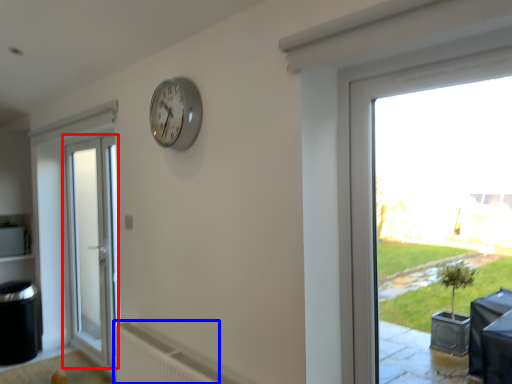
Question: Which object appears closest to the camera in this image, door (highlighted by a red box) or radiator (highlighted by a blue box)?

Choices:
 (A) door
 (B) radiator

Answer: (B)